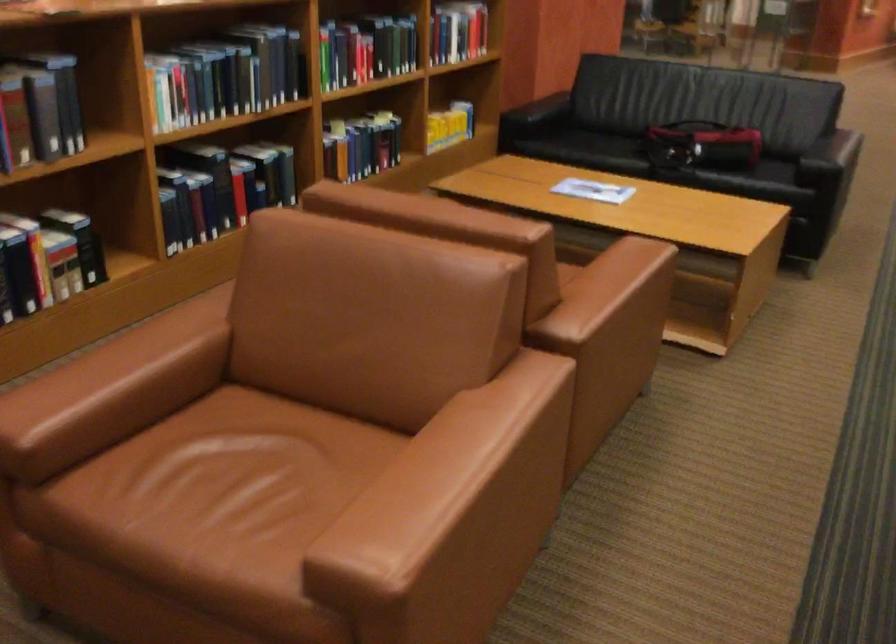
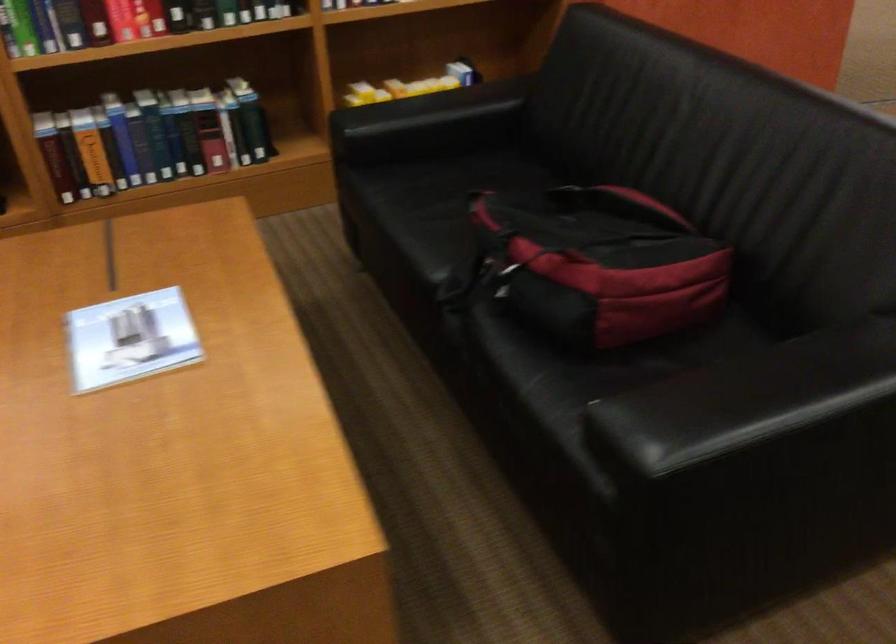
Where in the second image is the point corresponding to point (363, 71) from the first image?

(123, 21)